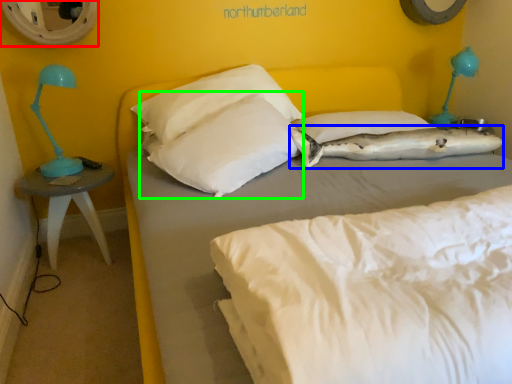
Question: Which object is positioned farthest from mirror (highlighted by a red box)? Select from pillow (highlighted by a blue box) and pillow (highlighted by a green box).

Choices:
 (A) pillow
 (B) pillow

Answer: (A)